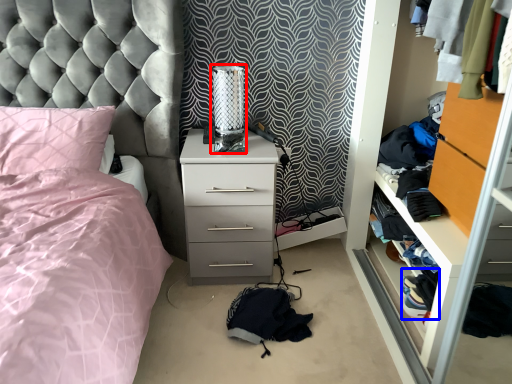
Question: Among these objects, which one is farthest to the camera, table lamp (highlighted by a red box) or clothing (highlighted by a blue box)?

Choices:
 (A) table lamp
 (B) clothing

Answer: (B)